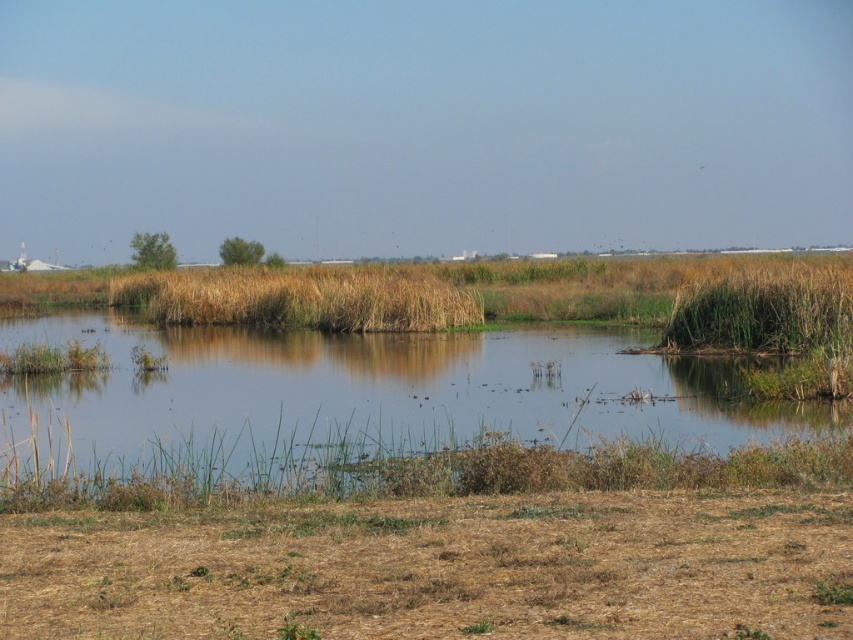
Based on the photo, is green grassy water at center closer to camera compared to brown grassy reed at center?

Yes, green grassy water at center is in front of brown grassy reed at center.

Who is lower down, green grassy water at center or brown grassy reed at center?

green grassy water at center

Is point (93, 458) in front of point (170, 289)?

Yes, point (93, 458) is closer to viewer.

Image resolution: width=853 pixels, height=640 pixels. What are the coordinates of `green grassy water at center` in the screenshot? It's located at (361, 403).